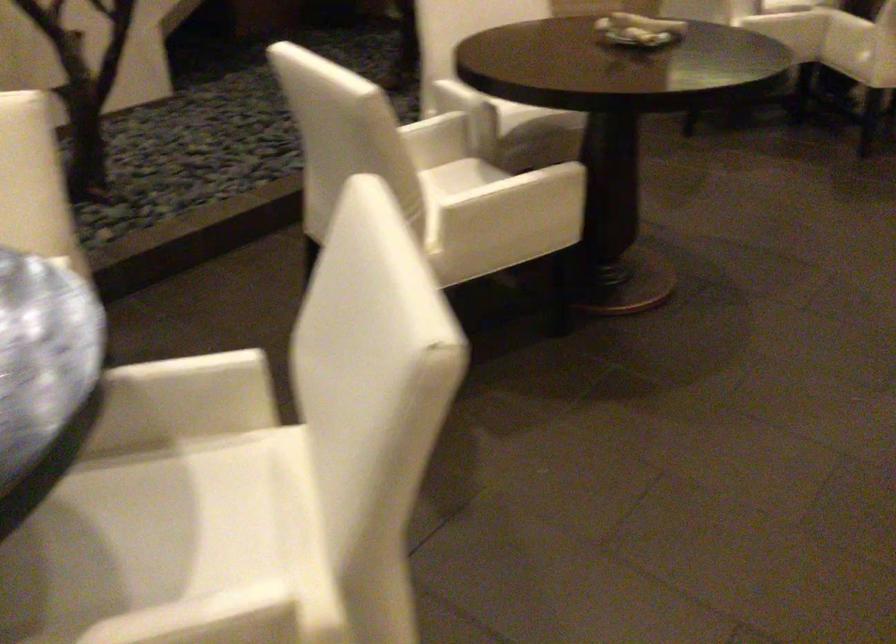
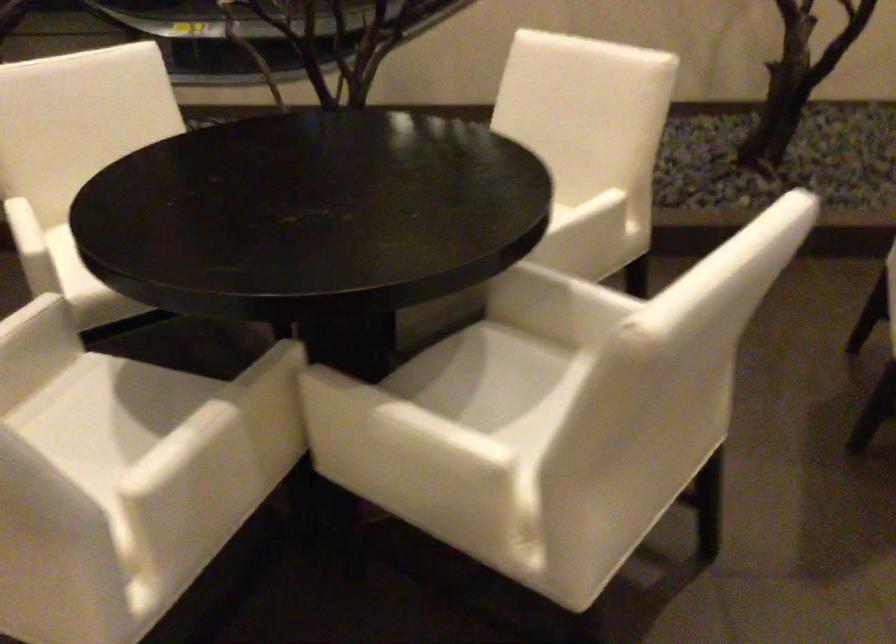
Find the pixel in the second image that matches [149,538] in the first image.

(504, 393)